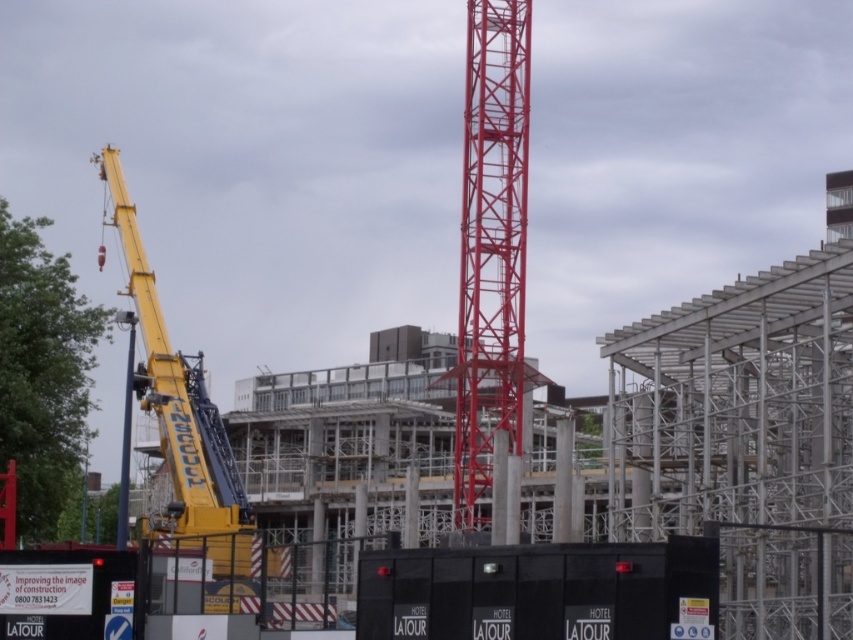
Question: Which point appears closest to the camera in this image?

Choices:
 (A) [x=125, y=524]
 (B) [x=517, y=376]
 (C) [x=181, y=365]

Answer: (A)

Question: Which point appears closest to the camera in this image?

Choices:
 (A) coord(248,563)
 (B) coord(519,84)
 (C) coord(129,428)
 (D) coord(703,577)

Answer: (D)

Question: Is metallic red crane at center bigger than yellow metallic crane at left?

Choices:
 (A) yes
 (B) no

Answer: (B)

Question: Does black rubber lift at lower center have a lesser width compared to blue painted metal pole at left?

Choices:
 (A) yes
 (B) no

Answer: (A)

Question: Is black rubber lift at lower center positioned before yellow metallic crane at left?

Choices:
 (A) no
 (B) yes

Answer: (B)

Question: Which of the following is the closest to the observer?

Choices:
 (A) blue painted metal pole at left
 (B) black rubber lift at lower center
 (C) yellow metallic crane at left
 (D) metallic red crane at center

Answer: (B)